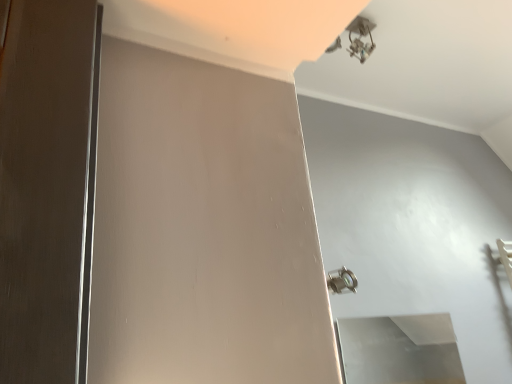
What is the approximate height of metallic reflective mirror at lower right?

The height of metallic reflective mirror at lower right is 10.96 inches.

This screenshot has height=384, width=512. What do you see at coordinates (399, 350) in the screenshot?
I see `metallic reflective mirror at lower right` at bounding box center [399, 350].

What are the coordinates of `metallic reflective mirror at lower right` in the screenshot? It's located at (399, 350).

I want to click on metallic reflective mirror at lower right, so click(x=399, y=350).